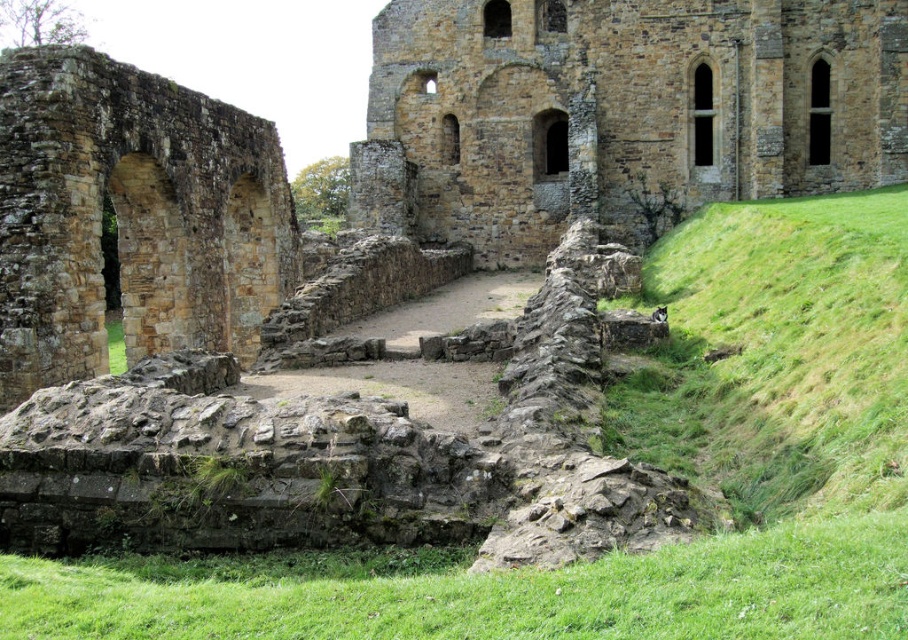
Between brown stone wall at center and brown stone arch at left, which one appears on the left side from the viewer's perspective?

brown stone arch at left is more to the left.

Between point (778, 180) and point (40, 108), which one is positioned behind?

The point (778, 180) is behind.

Find the location of a particular element. The height and width of the screenshot is (640, 908). brown stone wall at center is located at coordinates (619, 113).

The image size is (908, 640). I want to click on brown stone wall at center, so tap(619, 113).